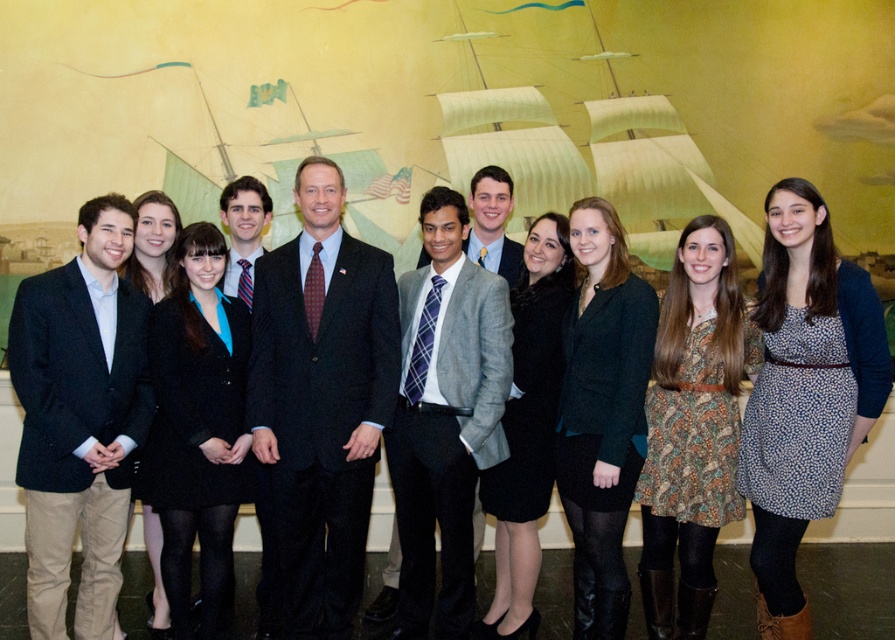
Measure the distance between dark gray suit at center and matte black suit at center.

dark gray suit at center and matte black suit at center are 30.24 inches apart.

Who is lower down, dark gray suit at center or matte black suit at center?

dark gray suit at center

Is point (320, 536) farther from camera compared to point (228, 182)?

No, it is not.

Find the location of a particular element. Image resolution: width=895 pixels, height=640 pixels. dark gray suit at center is located at coordinates (322, 400).

Between black woolen blazer at center and black wool coat at center, which one appears on the left side from the viewer's perspective?

black wool coat at center is more to the left.

Consider the image. Which is below, black woolen blazer at center or black wool coat at center?

black woolen blazer at center is lower down.

Which is behind, point (228, 506) or point (143, 228)?

The point (143, 228) is more distant.

This screenshot has height=640, width=895. In order to click on black woolen blazer at center in this screenshot , I will do `click(197, 426)`.

Is blue dotted dress at center smaller than dark green textured blazer at center?

Actually, blue dotted dress at center might be larger than dark green textured blazer at center.

Does blue dotted dress at center have a lesser height compared to dark green textured blazer at center?

Indeed, blue dotted dress at center has a lesser height compared to dark green textured blazer at center.

Between point (795, 230) and point (611, 541), which one is positioned behind?

Point (611, 541)

The width and height of the screenshot is (895, 640). What are the coordinates of `blue dotted dress at center` in the screenshot? It's located at (804, 394).